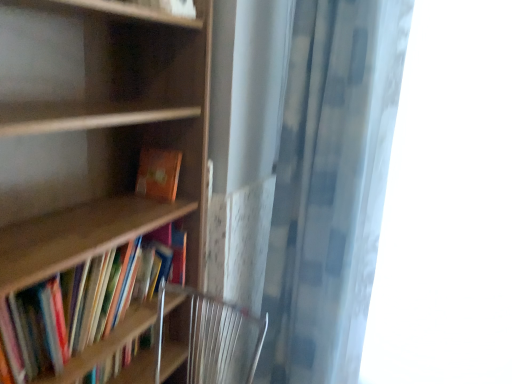
Question: Is wooden bookshelf at left, which appears as the 2th book when viewed from the top, taller than transparent fabric at right?

Choices:
 (A) yes
 (B) no

Answer: (B)

Question: From the image's perspective, is wooden bookshelf at left, which appears as the 1th book when ordered from the bottom, over transparent fabric at right?

Choices:
 (A) no
 (B) yes

Answer: (A)

Question: Are wooden bookshelf at left, which appears as the 1th book when ordered from the bottom, and transparent fabric at right located far from each other?

Choices:
 (A) no
 (B) yes

Answer: (B)

Question: Considering the relative sizes of wooden bookshelf at left, which appears as the 2th book when viewed from the top, and transparent fabric at right in the image provided, is wooden bookshelf at left, which appears as the 2th book when viewed from the top, thinner than transparent fabric at right?

Choices:
 (A) no
 (B) yes

Answer: (B)

Question: Does wooden bookshelf at left, which appears as the 1th book when ordered from the bottom, have a lesser height compared to transparent fabric at right?

Choices:
 (A) no
 (B) yes

Answer: (B)

Question: Is wooden bookcase at left taller or shorter than orange matte book at center, which is the 2th book in bottom-to-top order?

Choices:
 (A) short
 (B) tall

Answer: (B)

Question: Is point (x=3, y=185) positioned closer to the camera than point (x=158, y=185)?

Choices:
 (A) closer
 (B) farther

Answer: (A)

Question: In terms of width, does wooden bookcase at left look wider or thinner when compared to orange matte book at center, which is the 2th book in bottom-to-top order?

Choices:
 (A) thin
 (B) wide

Answer: (B)

Question: Considering the relative positions of wooden bookcase at left and orange matte book at center, which is the 2th book in bottom-to-top order, in the image provided, is wooden bookcase at left to the left or to the right of orange matte book at center, which is the 2th book in bottom-to-top order,?

Choices:
 (A) left
 (B) right

Answer: (A)

Question: Considering the positions of wooden bookshelf at left, which appears as the 1th book when ordered from the bottom, and wooden bookcase at left in the image, is wooden bookshelf at left, which appears as the 1th book when ordered from the bottom, taller or shorter than wooden bookcase at left?

Choices:
 (A) tall
 (B) short

Answer: (B)

Question: Does point (169, 231) appear closer or farther from the camera than point (188, 61)?

Choices:
 (A) closer
 (B) farther

Answer: (B)

Question: In terms of size, does wooden bookshelf at left, which appears as the 2th book when viewed from the top, appear bigger or smaller than wooden bookcase at left?

Choices:
 (A) big
 (B) small

Answer: (B)

Question: In terms of width, does wooden bookshelf at left, which appears as the 2th book when viewed from the top, look wider or thinner when compared to wooden bookcase at left?

Choices:
 (A) thin
 (B) wide

Answer: (A)

Question: From a real-world perspective, is wooden bookcase at left positioned above or below checkered fabric shower curtain at right?

Choices:
 (A) above
 (B) below

Answer: (B)

Question: Is point (202, 72) closer or farther from the camera than point (318, 150)?

Choices:
 (A) closer
 (B) farther

Answer: (A)